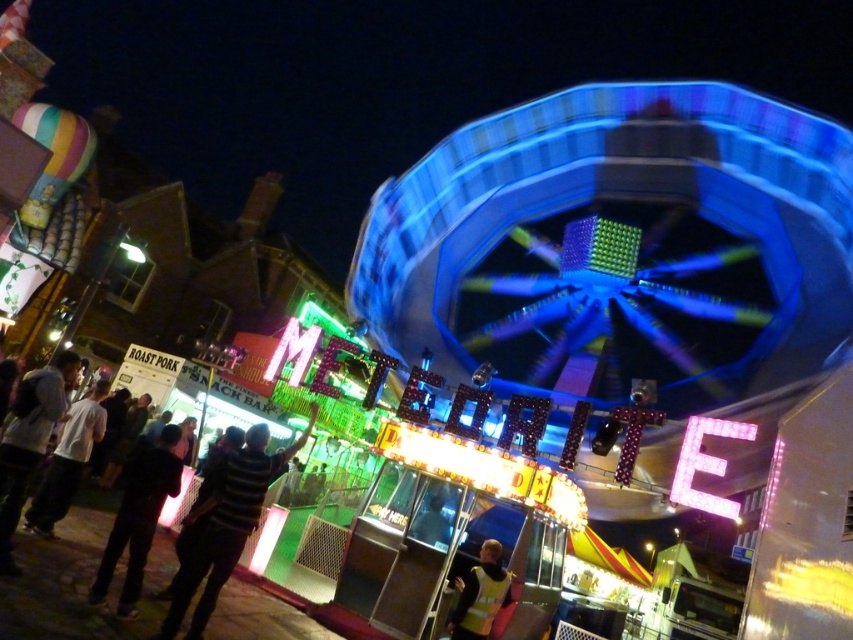
Question: Among these objects, which one is nearest to the camera?

Choices:
 (A) black fabric jacket at lower left
 (B) metallic silver helmet at center
 (C) dark gray jacket at lower left
 (D) white matte shirt at lower left

Answer: (C)

Question: Which object is farther from the camera taking this photo?

Choices:
 (A) metallic silver helmet at center
 (B) yellow reflective vest at center
 (C) black fabric jacket at lower left
 (D) white matte shirt at lower left

Answer: (A)

Question: Can you confirm if blue metallic ferris wheel at upper center is positioned to the left of dark blue jeans at lower left?

Choices:
 (A) yes
 (B) no

Answer: (B)

Question: Based on their relative distances, which object is farther from the metallic silver helmet at center?

Choices:
 (A) dark blue jeans at lower left
 (B) yellow reflective vest at center
 (C) blue metallic ferris wheel at upper center
 (D) white matte shirt at lower left

Answer: (C)

Question: Does yellow reflective vest at center appear under metallic silver helmet at center?

Choices:
 (A) yes
 (B) no

Answer: (A)

Question: Can you confirm if striped shirt at center is positioned above yellow reflective vest at center?

Choices:
 (A) no
 (B) yes

Answer: (B)